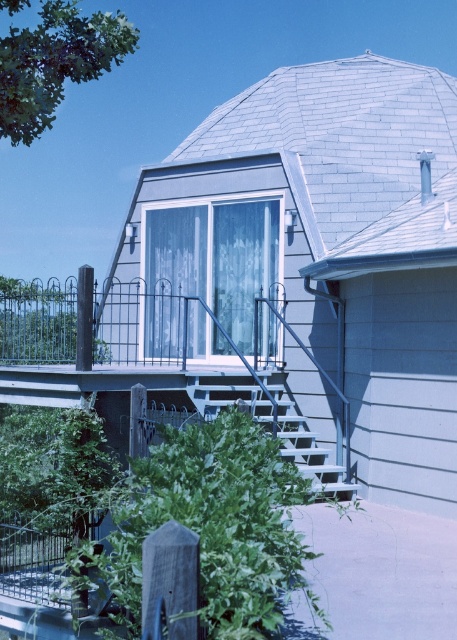
You are a delivery person trying to park your 2.5 meter wide delivery van. You see the metallic gray porch at center and the white matte stairs at lower center. Can you fit your van between them?

The metallic gray porch at center is thinner than white matte stairs at lower center. Since the van is 2.5 meters wide, the space between them may be sufficient if the combined width of both objects allows. However, without exact measurements, it is uncertain. Please check the actual dimensions before attempting to park.

You are standing at the entrance of the dome building and want to reach the metallic gray porch at center. Based on the coordinates provided, in which direction should you move from your current position?

The metallic gray porch at center is located at coordinates point (175, 355), so you should move towards the center of the building to reach it.

Based on the photo, you are a delivery person approaching the building and need to reach the entrance. The entrance is located at the metallic gray porch at center. Are the white matte stairs at lower center leading upwards or downwards from the porch?

The white matte stairs at lower center are leading upwards from the metallic gray porch at center because the porch is below the stairs.